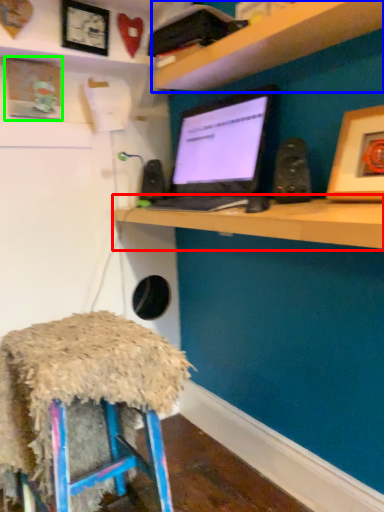
Question: Based on their relative distances, which object is nearer to computer (highlighted by a red box)? Choose from shelf (highlighted by a blue box) and picture frame (highlighted by a green box).

Choices:
 (A) shelf
 (B) picture frame

Answer: (A)